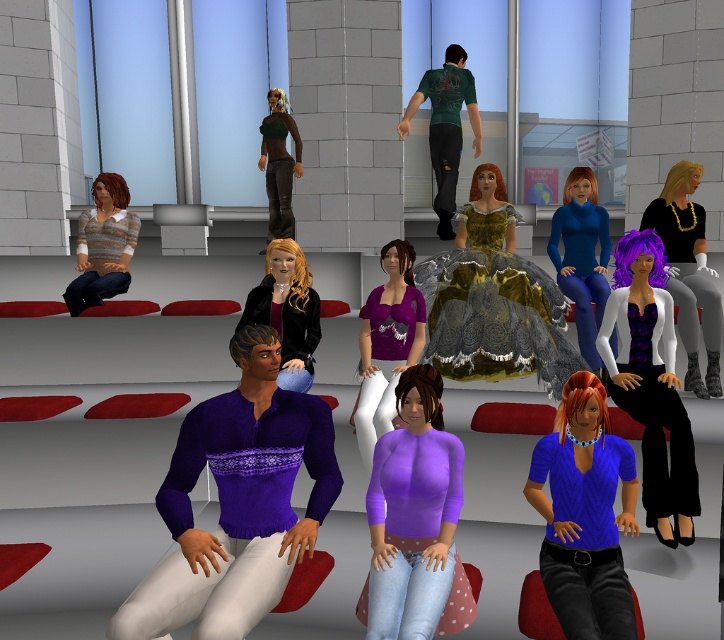
Can you confirm if gold textured gown at center is positioned above matte black dress at center?

Actually, gold textured gown at center is below matte black dress at center.

Between gold textured gown at center and matte black dress at center, which one appears on the left side from the viewer's perspective?

From the viewer's perspective, gold textured gown at center appears more on the left side.

Between point (505, 216) and point (699, 282), which one is positioned in front?

Point (699, 282)

In order to click on gold textured gown at center in this screenshot , I will do `click(492, 300)`.

Does point (222, 464) lie in front of point (694, 224)?

Yes.

Who is more forward, (316, 396) or (683, 388)?

Point (316, 396) is more forward.

Does point (321, 512) come in front of point (707, 280)?

Yes.

In order to click on purple knitted sweater at center in this screenshot , I will do `click(237, 502)`.

Is point (623, 307) in front of point (442, 99)?

Yes, it is in front of point (442, 99).

What do you see at coordinates (652, 385) in the screenshot?
I see `white matte vest at center` at bounding box center [652, 385].

Which is behind, point (647, 436) or point (439, 104)?

Positioned behind is point (439, 104).

Locate an element on the screen. This screenshot has height=640, width=724. white matte vest at center is located at coordinates (652, 385).